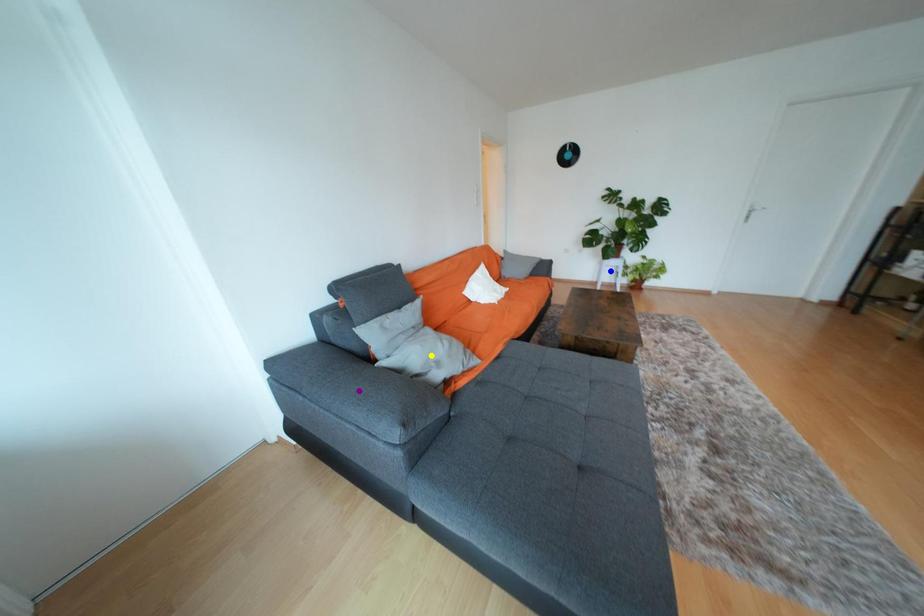
Order these from nearest to farthest:
1. blue point
2. yellow point
3. purple point

purple point → yellow point → blue point